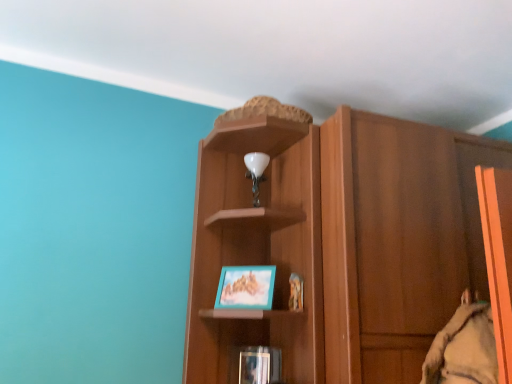
Question: Does matte black book at lower center have a smaller size compared to wooden cupboard at center?

Choices:
 (A) yes
 (B) no

Answer: (A)

Question: Considering the relative sizes of matte black book at lower center and wooden cupboard at center in the image provided, is matte black book at lower center thinner than wooden cupboard at center?

Choices:
 (A) no
 (B) yes

Answer: (B)

Question: Does matte black book at lower center lie behind wooden cupboard at center?

Choices:
 (A) yes
 (B) no

Answer: (A)

Question: From the image's perspective, is matte black book at lower center under wooden cupboard at center?

Choices:
 (A) yes
 (B) no

Answer: (A)

Question: From a real-world perspective, is matte black book at lower center on wooden cupboard at center?

Choices:
 (A) yes
 (B) no

Answer: (B)

Question: Is matte black book at lower center placed right next to wooden cupboard at center?

Choices:
 (A) no
 (B) yes

Answer: (A)

Question: Is wooden cupboard at center positioned behind teal matte picture frame at center?

Choices:
 (A) no
 (B) yes

Answer: (A)

Question: From the image's perspective, is wooden cupboard at center over teal matte picture frame at center?

Choices:
 (A) yes
 (B) no

Answer: (A)

Question: Is wooden cupboard at center aimed at teal matte picture frame at center?

Choices:
 (A) yes
 (B) no

Answer: (B)

Question: Is wooden cupboard at center to the right of teal matte picture frame at center from the viewer's perspective?

Choices:
 (A) yes
 (B) no

Answer: (A)

Question: From a real-world perspective, is wooden cupboard at center on top of teal matte picture frame at center?

Choices:
 (A) yes
 (B) no

Answer: (A)

Question: Is wooden cupboard at center bigger than teal matte picture frame at center?

Choices:
 (A) no
 (B) yes

Answer: (B)

Question: Is wooden cupboard at center far away from matte black book at lower center?

Choices:
 (A) no
 (B) yes

Answer: (A)